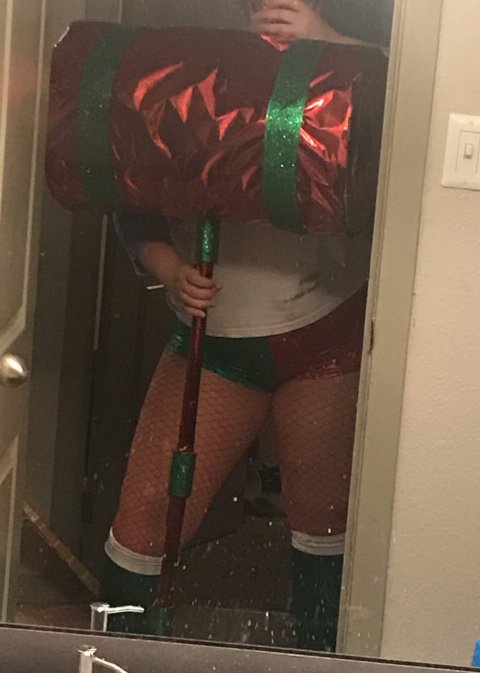
At what (x,y) coordinates should I click in order to perform the action: click on reflection of dispenser tube/spout. Please return your answer as a coordinate pair (x, y). Image resolution: width=480 pixels, height=673 pixels. Looking at the image, I should click on (127, 608).